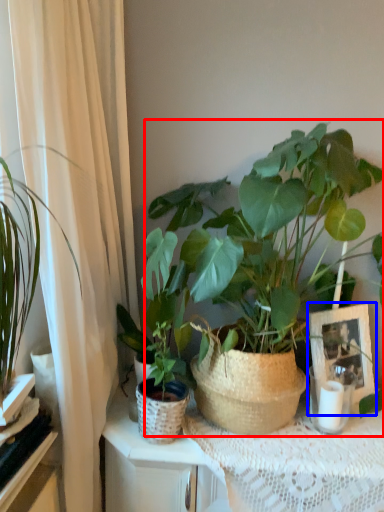
Question: Among these objects, which one is farthest to the camera, houseplant (highlighted by a red box) or picture frame (highlighted by a blue box)?

Choices:
 (A) houseplant
 (B) picture frame

Answer: (B)